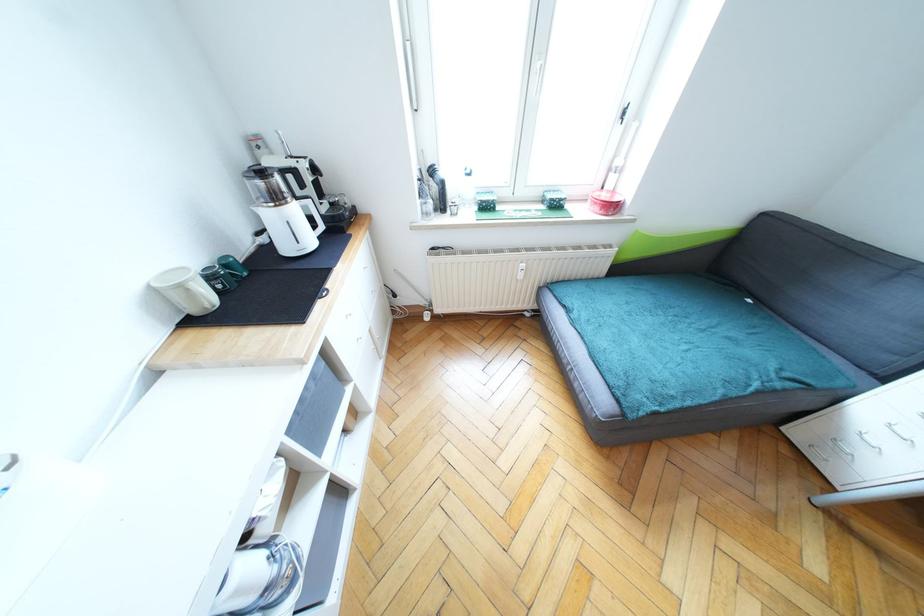
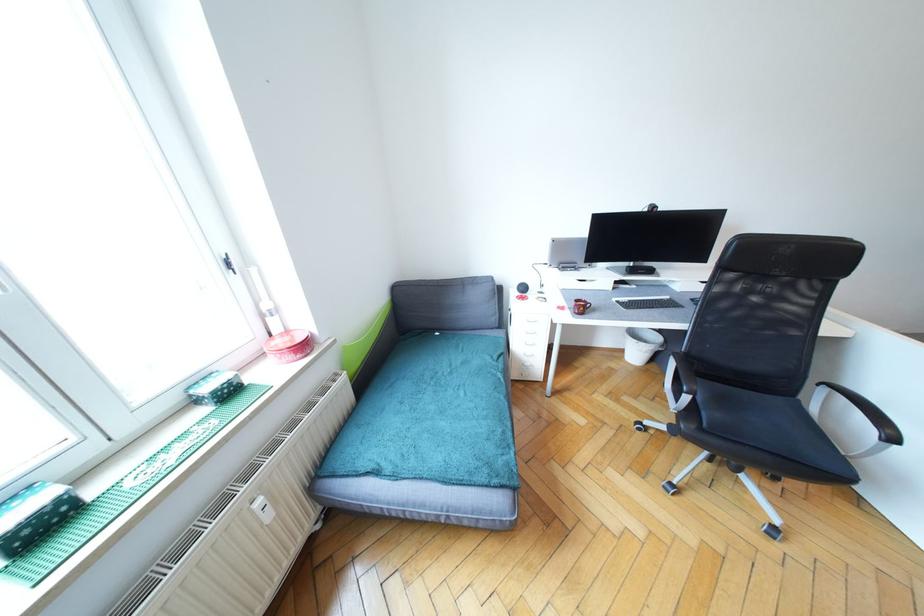
Find the pixel in the second image that matches [782,386] in the first image.

(504, 367)